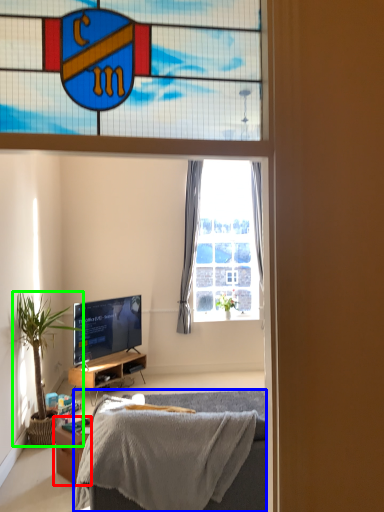
Question: Which object is the farthest from desk (highlighted by a red box)? Choose among these: bed (highlighted by a blue box) or houseplant (highlighted by a green box).

Choices:
 (A) bed
 (B) houseplant

Answer: (A)